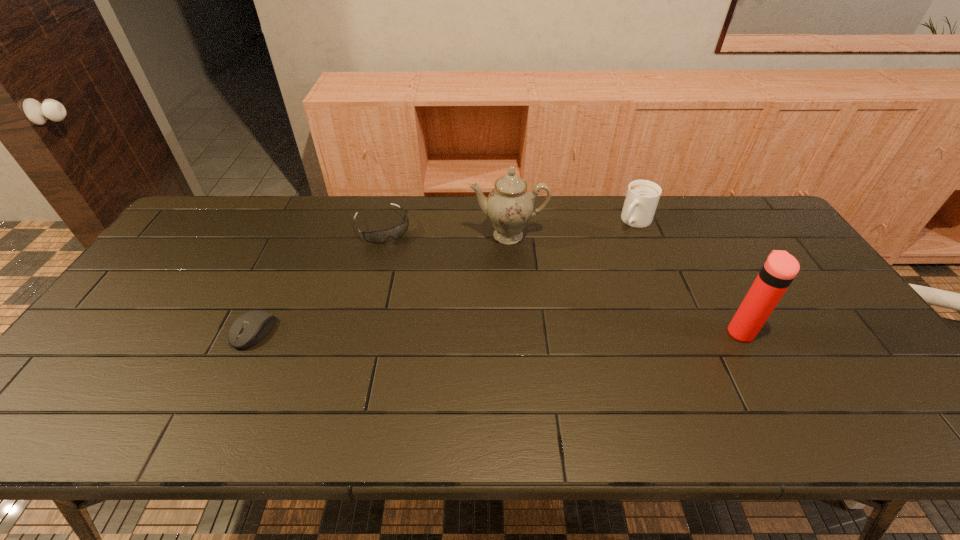
Identify the location of vacant point located 0.080m on the spout of the chinaware. The height and width of the screenshot is (540, 960). (508, 268).

Where is `vacant space located on the spout of the chinaware`? The image size is (960, 540). vacant space located on the spout of the chinaware is located at coordinates (510, 344).

The width and height of the screenshot is (960, 540). Find the location of `vacant space situated on the spout of the chinaware`. vacant space situated on the spout of the chinaware is located at coordinates (509, 316).

You are a GUI agent. You are given a task and a screenshot of the screen. Output one action in this format:
    pyautogui.click(x=<x>, y=<y>)
    Task: Click on the blank area located on the lenses of the second shortest object
    The height and width of the screenshot is (540, 960).
    Given the screenshot: What is the action you would take?
    pyautogui.click(x=412, y=281)

Where is `free region located on the lenses of the second shortest object`? The width and height of the screenshot is (960, 540). free region located on the lenses of the second shortest object is located at coordinates (420, 295).

Where is `vacant point located on the lenses of the second shortest object`? vacant point located on the lenses of the second shortest object is located at coordinates (410, 277).

Locate an element on the screen. vacant space located on the side with the handle of the third tallest object is located at coordinates (565, 296).

Locate an element on the screen. This screenshot has height=540, width=960. free space located on the side with the handle of the third tallest object is located at coordinates (565, 296).

I want to click on vacant space located on the side with the handle of the third tallest object, so [x=564, y=299].

Locate an element on the screen. The width and height of the screenshot is (960, 540). chinaware that is at the far edge is located at coordinates (510, 205).